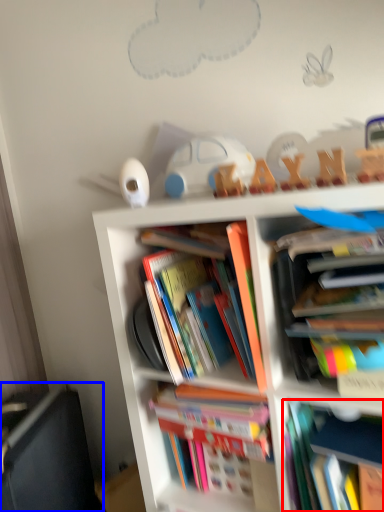
Question: Which object is further to the camera taking this photo, book (highlighted by a red box) or shelf (highlighted by a blue box)?

Choices:
 (A) book
 (B) shelf

Answer: (B)